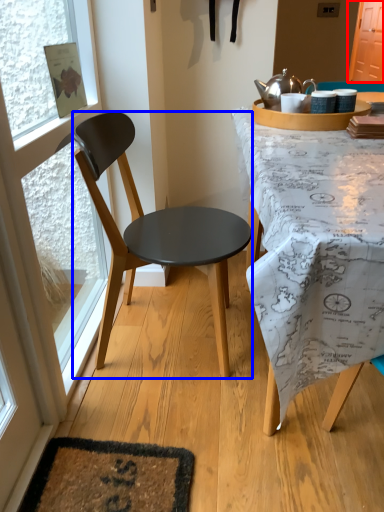
Question: Which point is closer to the camera, screen door (highlighted by a red box) or chair (highlighted by a blue box)?

Choices:
 (A) screen door
 (B) chair

Answer: (B)